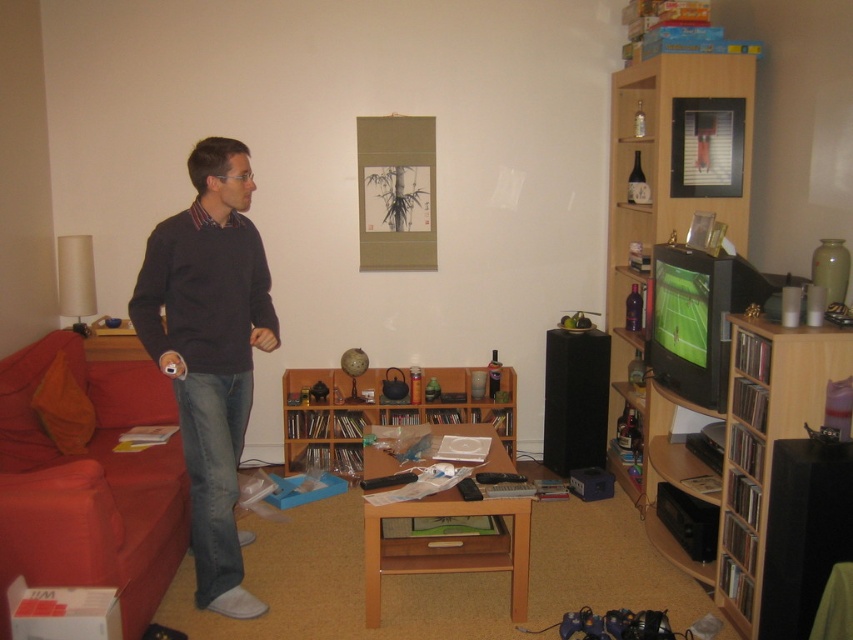
Is point (212, 204) closer to camera compared to point (839, 349)?

No.

Between dark gray sweater at left and wooden bookshelf at right, which one is positioned lower?

wooden bookshelf at right is below.

Is point (212, 280) farther from viewer compared to point (746, 538)?

No, it is not.

Find the location of a particular element. dark gray sweater at left is located at coordinates (210, 352).

Between point (120, 488) and point (432, 416), which one is positioned behind?

The point (432, 416) is more distant.

At what (x,y) coordinates should I click in order to perform the action: click on red fabric couch at left. Please return your answer as a coordinate pair (x, y). Looking at the image, I should click on (90, 484).

The height and width of the screenshot is (640, 853). Find the location of `red fabric couch at left`. red fabric couch at left is located at coordinates (90, 484).

Can you confirm if wooden bookshelf at right is taller than wooden bookshelf at center?

Indeed, wooden bookshelf at right has a greater height compared to wooden bookshelf at center.

Does wooden bookshelf at right appear on the left side of wooden bookshelf at center?

No, wooden bookshelf at right is not to the left of wooden bookshelf at center.

Find the location of a particular element. wooden bookshelf at right is located at coordinates (764, 442).